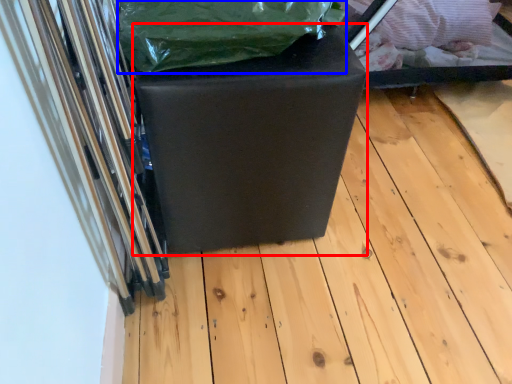
Question: Which of the following is the farthest to the observer, furniture (highlighted by a red box) or waste (highlighted by a blue box)?

Choices:
 (A) furniture
 (B) waste

Answer: (A)